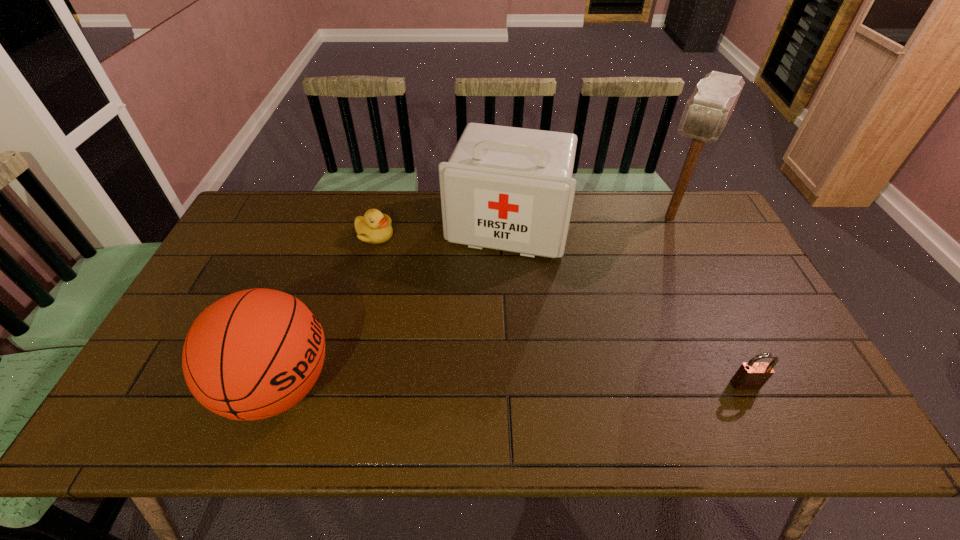
Locate an element on the screen. This screenshot has width=960, height=540. vacant region between the shortest object and the second tallest object is located at coordinates (441, 230).

Find the location of a particular element. Image resolution: width=960 pixels, height=540 pixels. empty space between the third object from left to right and the duckling is located at coordinates (441, 230).

At what (x,y) coordinates should I click in order to perform the action: click on vacant area that lies between the second shortest object and the basketball. Please return your answer as a coordinate pair (x, y). The height and width of the screenshot is (540, 960). Looking at the image, I should click on (512, 386).

This screenshot has height=540, width=960. I want to click on vacant space that's between the third shortest object and the duckling, so click(326, 310).

Where is `free point between the duckling and the padlock`? The height and width of the screenshot is (540, 960). free point between the duckling and the padlock is located at coordinates (560, 310).

Find the location of `vacant area that lies between the second tallest object and the mallet`. vacant area that lies between the second tallest object and the mallet is located at coordinates (588, 221).

Identify the location of vacant space that's between the fourth tallest object and the second tallest object. This screenshot has width=960, height=540. (627, 305).

I want to click on free spot between the fourth tallest object and the mallet, so click(x=708, y=301).

Find the location of a particular element. This screenshot has height=540, width=960. empty location between the basketball and the mallet is located at coordinates (474, 302).

Identify the location of free area in between the first-aid kit and the duckling. pos(441,230).